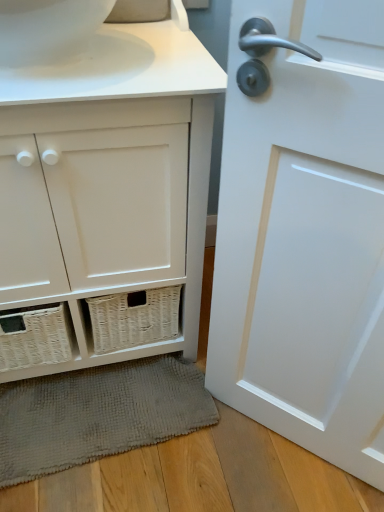
This screenshot has width=384, height=512. What do you see at coordinates (305, 236) in the screenshot?
I see `white glossy door at right` at bounding box center [305, 236].

Find the location of a particular element. This screenshot has width=384, height=512. white glossy door at right is located at coordinates (305, 236).

Measure the distance between white glossy toilet bowl at upper left and camera.

white glossy toilet bowl at upper left and camera are 60.40 centimeters apart from each other.

Locate an element on the screen. The width and height of the screenshot is (384, 512). white glossy door at right is located at coordinates (305, 236).

Does white glossy door at right have a lesser height compared to gray textured bath mat at lower center?

Incorrect, the height of white glossy door at right does not fall short of that of gray textured bath mat at lower center.

Would you say white glossy door at right is outside gray textured bath mat at lower center?

Yes, white glossy door at right is located beyond the bounds of gray textured bath mat at lower center.

From a real-world perspective, which object rests below the other?

gray textured bath mat at lower center.

Is white glossy door at right aimed at gray textured bath mat at lower center?

No, white glossy door at right is not aimed at gray textured bath mat at lower center.

From the image's perspective, is gray textured bath mat at lower center on top of white glossy toilet bowl at upper left?

No.

Is gray textured bath mat at lower center not within white glossy toilet bowl at upper left?

Absolutely, gray textured bath mat at lower center is external to white glossy toilet bowl at upper left.

Is gray textured bath mat at lower center smaller than white glossy toilet bowl at upper left?

No, gray textured bath mat at lower center is not smaller than white glossy toilet bowl at upper left.

Between white glossy toilet bowl at upper left and gray textured bath mat at lower center, which one is positioned behind?

gray textured bath mat at lower center is further from the camera.

Between white glossy toilet bowl at upper left and gray textured bath mat at lower center, which one has smaller size?

Smaller between the two is white glossy toilet bowl at upper left.

Between white glossy toilet bowl at upper left and gray textured bath mat at lower center, which one has more height?

white glossy toilet bowl at upper left.

From a real-world perspective, between white glossy toilet bowl at upper left and gray textured bath mat at lower center, who is vertically higher?

In real-world perspective, white glossy toilet bowl at upper left is above.

How many degrees apart are the facing directions of white wicker basket at lower left and gray textured bath mat at lower center?

The angle between the facing direction of white wicker basket at lower left and the facing direction of gray textured bath mat at lower center is 3.66 degrees.

Can we say white wicker basket at lower left lies outside gray textured bath mat at lower center?

Indeed, white wicker basket at lower left is completely outside gray textured bath mat at lower center.

Measure the distance from white wicker basket at lower left to gray textured bath mat at lower center.

Answer: white wicker basket at lower left and gray textured bath mat at lower center are 14.04 inches apart from each other.

Is point (38, 153) positioned after point (104, 401)?

That is False.

What's the angular difference between gray textured bath mat at lower center and white glossy door at right's facing directions?

There is a 45.5-degree angle between the facing directions of gray textured bath mat at lower center and white glossy door at right.

Could you tell me if gray textured bath mat at lower center is turned towards white glossy door at right?

No, gray textured bath mat at lower center is not turned towards white glossy door at right.

Find the location of a particular element. door to the right of gray textured bath mat at lower center is located at coordinates (305, 236).

Based on the photo, is white wicker basket at lower left shorter than white glossy door at right?

Yes.

What's the angular difference between white wicker basket at lower left and white glossy door at right's facing directions?

The facing directions of white wicker basket at lower left and white glossy door at right are 41.8 degrees apart.

Choose the correct answer: Is white wicker basket at lower left inside white glossy door at right or outside it?

white wicker basket at lower left lies outside white glossy door at right.

Considering the sizes of objects white glossy door at right and white glossy toilet bowl at upper left in the image provided, who is thinner, white glossy door at right or white glossy toilet bowl at upper left?

Thinner between the two is white glossy door at right.

Does point (253, 342) appear closer or farther from the camera than point (65, 18)?

Point (253, 342) is farther from the camera than point (65, 18).

Is white glossy door at right oriented away from white glossy toilet bowl at upper left?

No, white glossy door at right is not facing away from white glossy toilet bowl at upper left.

Find the location of a particular element. bath mat below the white glossy door at right (from a real-world perspective) is located at coordinates (97, 414).

Find the location of a particular element. The width and height of the screenshot is (384, 512). toilet bowl in front of the gray textured bath mat at lower center is located at coordinates (47, 29).

When comparing their distances from gray textured bath mat at lower center, does white glossy toilet bowl at upper left or white wicker basket at lower left seem further?

white glossy toilet bowl at upper left is positioned further to the anchor gray textured bath mat at lower center.

Estimate the real-world distances between objects in this image. Which object is further from white wicker basket at lower left, white glossy toilet bowl at upper left or white glossy door at right?

Based on the image, white glossy toilet bowl at upper left appears to be further to white wicker basket at lower left.

From the image, which object appears to be farther from white wicker basket at lower left, white glossy toilet bowl at upper left or gray textured bath mat at lower center?

Among the two, gray textured bath mat at lower center is located further to white wicker basket at lower left.

From the image, which object appears to be farther from white wicker basket at lower left, gray textured bath mat at lower center or white glossy toilet bowl at upper left?

The object further to white wicker basket at lower left is gray textured bath mat at lower center.

Looking at the image, which one is located closer to white glossy door at right, white glossy toilet bowl at upper left or white wicker basket at lower left?

Among the two, white wicker basket at lower left is located nearer to white glossy door at right.

From the picture: Which object lies nearer to the anchor point gray textured bath mat at lower center, white glossy toilet bowl at upper left or white glossy door at right?

white glossy door at right lies closer to gray textured bath mat at lower center than the other object.

Looking at the image, which one is located closer to gray textured bath mat at lower center, white wicker basket at lower left or white glossy toilet bowl at upper left?

white wicker basket at lower left lies closer to gray textured bath mat at lower center than the other object.

Which object lies further to the anchor point white glossy toilet bowl at upper left, white wicker basket at lower left or gray textured bath mat at lower center?

gray textured bath mat at lower center is positioned further to the anchor white glossy toilet bowl at upper left.

I want to click on door between white glossy toilet bowl at upper left and gray textured bath mat at lower center in the up-down direction, so click(305, 236).

You are a GUI agent. You are given a task and a screenshot of the screen. Output one action in this format:
    pyautogui.click(x=<x>, y=<y>)
    Task: Click on the toilet bowl situated between white wicker basket at lower left and white glossy door at right from left to right
    
    Given the screenshot: What is the action you would take?
    pyautogui.click(x=47, y=29)

The width and height of the screenshot is (384, 512). What are the coordinates of `bathroom cabinet located between white glossy door at right and gray textured bath mat at lower center in the depth direction` in the screenshot? It's located at (105, 197).

Locate an element on the screen. The width and height of the screenshot is (384, 512). bathroom cabinet that lies between white glossy toilet bowl at upper left and gray textured bath mat at lower center from top to bottom is located at coordinates (105, 197).